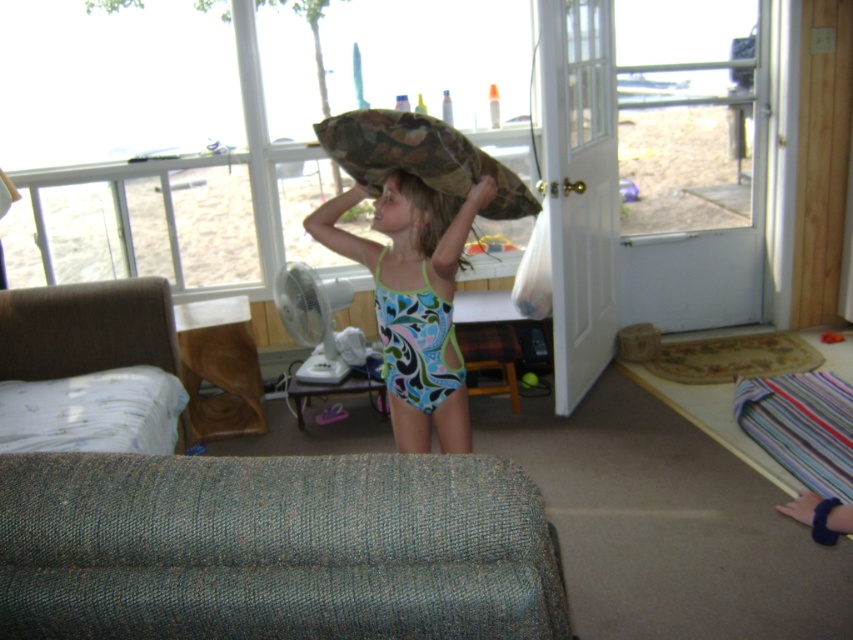
Is point (462, 230) positioned behind point (474, 179)?

No, it is in front of (474, 179).

Is point (437, 362) behind point (369, 150)?

That is True.

Find the location of a particular element. This screenshot has width=853, height=640. blue printed swimsuit at center is located at coordinates (413, 300).

Is camouflage fabric pillow at center closer to camera compared to blue-green swimsuit at center?

Yes, it is.

In the scene shown: Between camouflage fabric pillow at center and blue-green swimsuit at center, which one appears on the right side from the viewer's perspective?

camouflage fabric pillow at center

Is point (514, 196) positioned behind point (418, 243)?

Yes, point (514, 196) is farther from viewer.

I want to click on camouflage fabric pillow at center, so click(419, 157).

Is white wood screen door at right below blue printed swimsuit at center?

No, white wood screen door at right is not below blue printed swimsuit at center.

Does white wood screen door at right appear on the right side of blue printed swimsuit at center?

Yes, white wood screen door at right is to the right of blue printed swimsuit at center.

Does point (618, 202) come closer to viewer compared to point (453, 269)?

No.

This screenshot has width=853, height=640. I want to click on white wood screen door at right, so pyautogui.click(x=579, y=188).